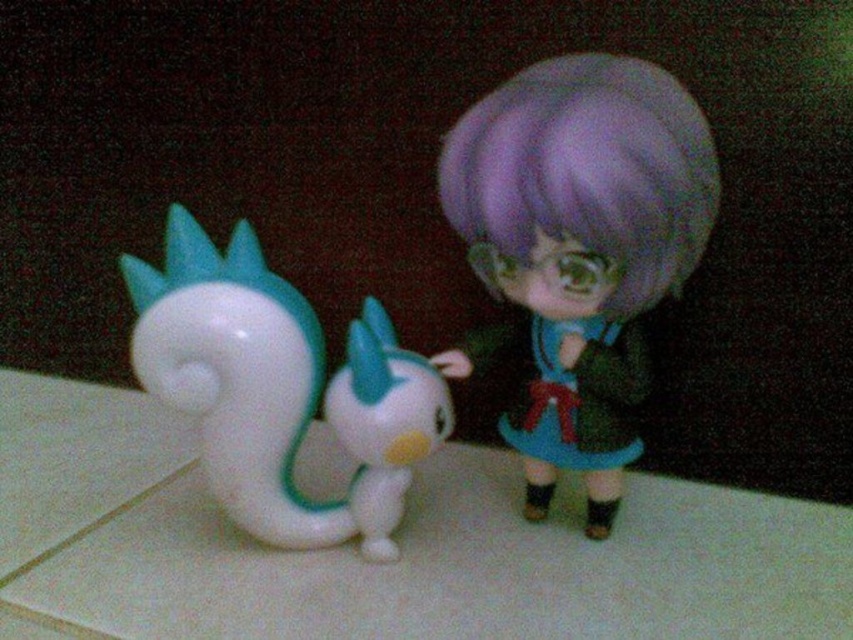
In the scene shown: Which is below, purple matte doll at center or white glossy toy at left?

white glossy toy at left

Which is above, purple matte doll at center or white glossy toy at left?

purple matte doll at center

The image size is (853, 640). I want to click on purple matte doll at center, so click(581, 244).

You are a GUI agent. You are given a task and a screenshot of the screen. Output one action in this format:
    pyautogui.click(x=<x>, y=<y>)
    Task: Click on the purple matte doll at center
    
    Given the screenshot: What is the action you would take?
    pyautogui.click(x=581, y=244)

Describe the element at coordinates (279, 388) in the screenshot. I see `white glossy toy at left` at that location.

Does white glossy toy at left appear on the left side of white glossy bird at center?

Yes, white glossy toy at left is to the left of white glossy bird at center.

Between point (305, 349) and point (368, 464), which one is positioned behind?

Point (368, 464)

Find the location of a particular element. This screenshot has width=853, height=640. white glossy toy at left is located at coordinates (279, 388).

Who is more distant from viewer, (538, 490) or (386, 362)?

Point (538, 490)

Where is `purple matte doll at center`? purple matte doll at center is located at coordinates click(x=581, y=244).